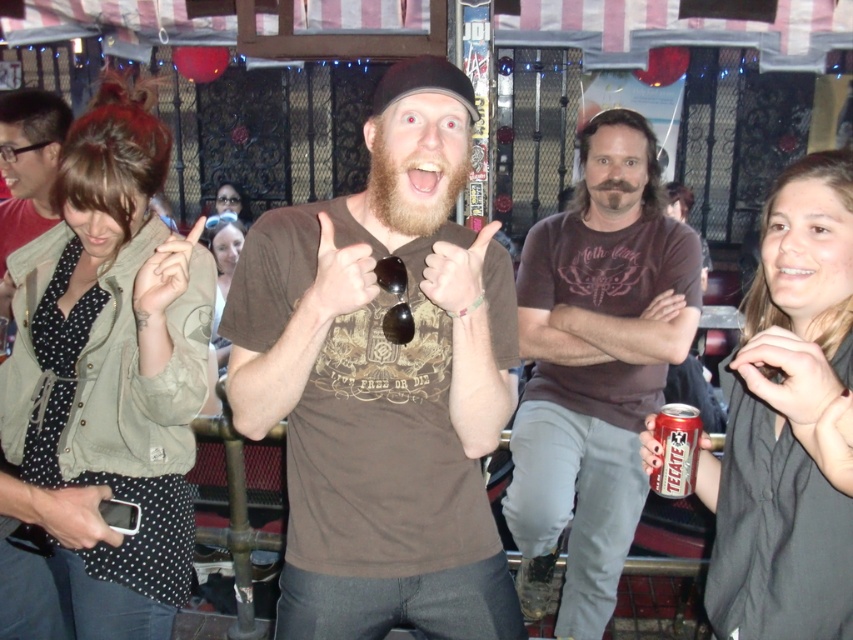
Based on the scene description, which object is positioned lower between the matte black shirt at center and the matte black jacket at center?

The matte black shirt at center is positioned below the matte black jacket at center, so it is lower.